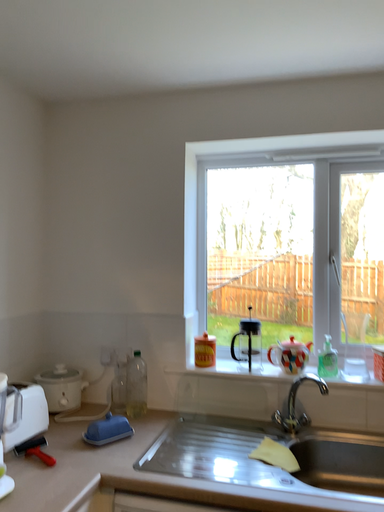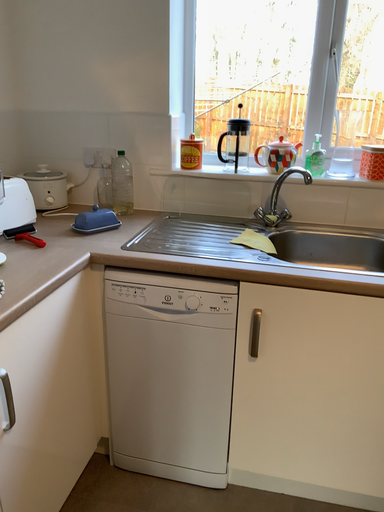
Question: Which way did the camera rotate in the video?

Choices:
 (A) rotated downward
 (B) rotated upward

Answer: (A)